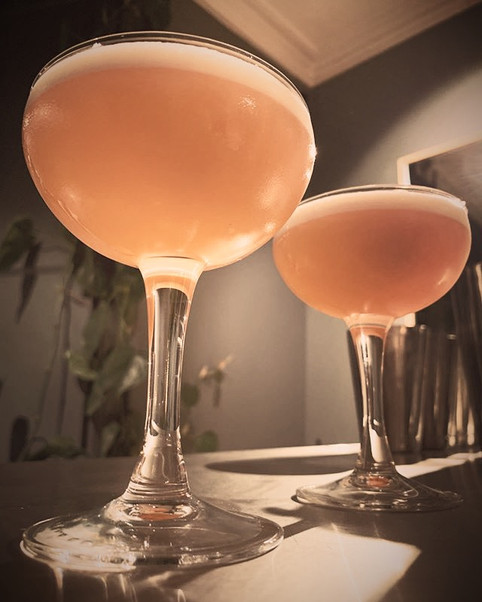
This screenshot has height=602, width=482. What are the coordinates of `metal cup` in the screenshot? It's located at (423, 377).